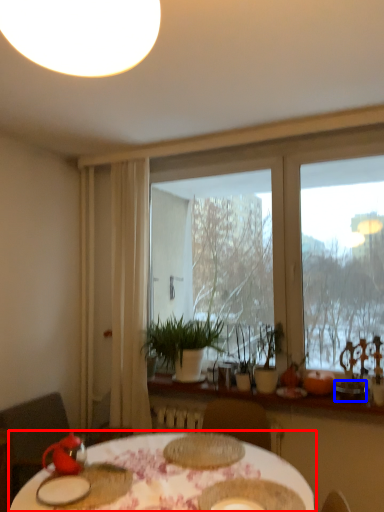
Question: Which object appears farthest to the camera in this image, table (highlighted by a red box) or tableware (highlighted by a blue box)?

Choices:
 (A) table
 (B) tableware

Answer: (B)